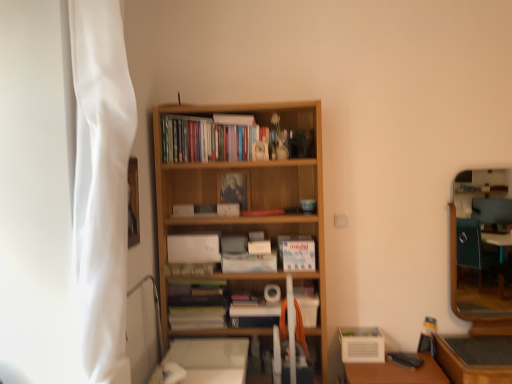
Question: Can you confirm if wooden table at lower right is positioned to the right of wooden bookcase at center?

Choices:
 (A) no
 (B) yes

Answer: (B)

Question: Is wooden table at lower right placed right next to wooden bookcase at center?

Choices:
 (A) yes
 (B) no

Answer: (B)

Question: From a real-world perspective, is wooden table at lower right on top of wooden bookcase at center?

Choices:
 (A) yes
 (B) no

Answer: (B)

Question: Is wooden table at lower right wider than wooden bookcase at center?

Choices:
 (A) yes
 (B) no

Answer: (A)

Question: Is wooden bookcase at center at the back of wooden table at lower right?

Choices:
 (A) no
 (B) yes

Answer: (A)

Question: Is blue matte paperback book at center, which is the second paperback book from top to bottom, inside the boundaries of wooden framed mirror at right, or outside?

Choices:
 (A) outside
 (B) inside

Answer: (A)

Question: From a real-world perspective, is blue matte paperback book at center, which is the second paperback book from top to bottom, above or below wooden framed mirror at right?

Choices:
 (A) above
 (B) below

Answer: (A)

Question: From their relative heights in the image, would you say blue matte paperback book at center, which is the second paperback book from top to bottom, is taller or shorter than wooden framed mirror at right?

Choices:
 (A) short
 (B) tall

Answer: (A)

Question: Looking at their shapes, would you say blue matte paperback book at center, the 3th paperback book positioned from the bottom, is wider or thinner than wooden framed mirror at right?

Choices:
 (A) wide
 (B) thin

Answer: (B)

Question: Would you say wooden bookcase at center is inside or outside white matte book at center, acting as the second book starting from the top?

Choices:
 (A) outside
 (B) inside

Answer: (A)

Question: From the image's perspective, is wooden bookcase at center located above or below white matte book at center, the 1th book when ordered from right to left?

Choices:
 (A) below
 (B) above

Answer: (B)

Question: From a real-world perspective, is wooden bookcase at center physically located above or below white matte book at center, the 1th book when ordered from bottom to top?

Choices:
 (A) below
 (B) above

Answer: (B)

Question: Relative to white matte book at center, the second book viewed from the left, is wooden bookcase at center in front or behind?

Choices:
 (A) behind
 (B) front

Answer: (B)

Question: Considering the positions of white matte paperback book at center, placed as the first paperback book when sorted from bottom to top, and matte wooden frame at center, positioned as the fourth paperback book in bottom-to-top order, in the image, is white matte paperback book at center, placed as the first paperback book when sorted from bottom to top, wider or thinner than matte wooden frame at center, positioned as the fourth paperback book in bottom-to-top order,?

Choices:
 (A) thin
 (B) wide

Answer: (B)

Question: Is white matte paperback book at center, placed as the first paperback book when sorted from bottom to top, bigger or smaller than matte wooden frame at center, positioned as the fourth paperback book in bottom-to-top order?

Choices:
 (A) small
 (B) big

Answer: (B)